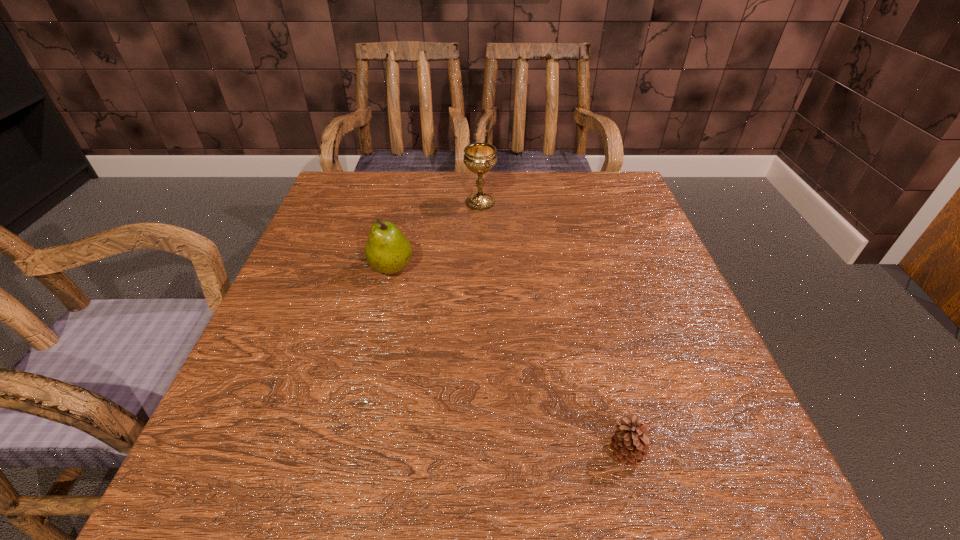
This screenshot has height=540, width=960. I want to click on object present at the near edge, so click(630, 445).

You are a GUI agent. You are given a task and a screenshot of the screen. Output one action in this format:
    pyautogui.click(x=<x>, y=<y>)
    Task: Click on the object that is at the left edge
    The width and height of the screenshot is (960, 540).
    Given the screenshot: What is the action you would take?
    387,250

In order to click on object present at the right edge in this screenshot , I will do `click(630, 445)`.

The width and height of the screenshot is (960, 540). I want to click on object situated at the near right corner, so click(630, 445).

In the image, there is a desktop. Where is `blank space at the far edge`? Image resolution: width=960 pixels, height=540 pixels. blank space at the far edge is located at coordinates (460, 177).

In the image, there is a desktop. What are the coordinates of `vacant space at the left edge` in the screenshot? It's located at (333, 357).

Locate an element on the screen. The image size is (960, 540). blank space at the right edge is located at coordinates (671, 350).

The height and width of the screenshot is (540, 960). Find the location of `free region at the far left corner of the desktop`. free region at the far left corner of the desktop is located at coordinates click(394, 175).

The height and width of the screenshot is (540, 960). What are the coordinates of `vacant position at the near left corner of the desktop` in the screenshot? It's located at (301, 461).

The height and width of the screenshot is (540, 960). In the image, there is a desktop. In order to click on vacant space at the far right corner in this screenshot , I will do `click(592, 192)`.